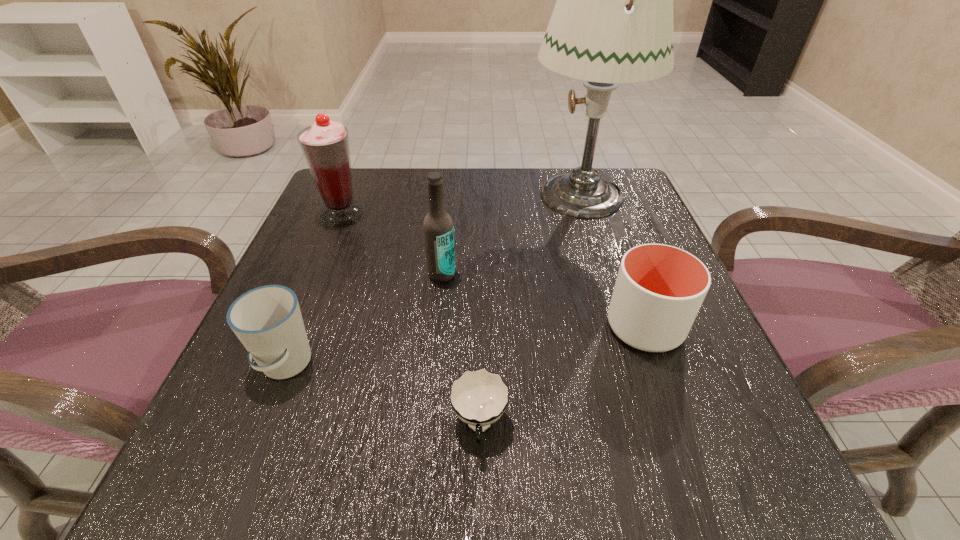
Identify the location of vacant space at the near right corner of the desktop. (723, 500).

Locate an element on the screen. The image size is (960, 540). free space between the tallest object and the rightmost cup is located at coordinates (613, 260).

Find the location of a particular element. This screenshot has width=960, height=540. free space that is in between the lampshade and the fourth object from right to left is located at coordinates (512, 234).

Where is `vacant space that's between the rightmost cup and the fourth nearest object`? Image resolution: width=960 pixels, height=540 pixels. vacant space that's between the rightmost cup and the fourth nearest object is located at coordinates (543, 300).

Locate an element on the screen. This screenshot has width=960, height=540. free space between the smoothie and the shortest object is located at coordinates (411, 320).

Locate an element on the screen. The height and width of the screenshot is (540, 960). free space between the second cup from right to left and the lampshade is located at coordinates (530, 310).

The width and height of the screenshot is (960, 540). Find the location of `vacant space that is in between the rightmost cup and the third object from left to right`. vacant space that is in between the rightmost cup and the third object from left to right is located at coordinates (543, 300).

Where is `free space between the smoothie and the lampshade`? This screenshot has width=960, height=540. free space between the smoothie and the lampshade is located at coordinates (462, 205).

You are a GUI agent. You are given a task and a screenshot of the screen. Output one action in this format:
    pyautogui.click(x=<x>, y=<y>)
    Task: Click on the free spot between the smoothie and the second cup from left to right
    The height and width of the screenshot is (540, 960).
    Given the screenshot: What is the action you would take?
    pyautogui.click(x=411, y=320)

Find the location of `object identified as the fourth closest to the shortest cup`. object identified as the fourth closest to the shortest cup is located at coordinates (612, 23).